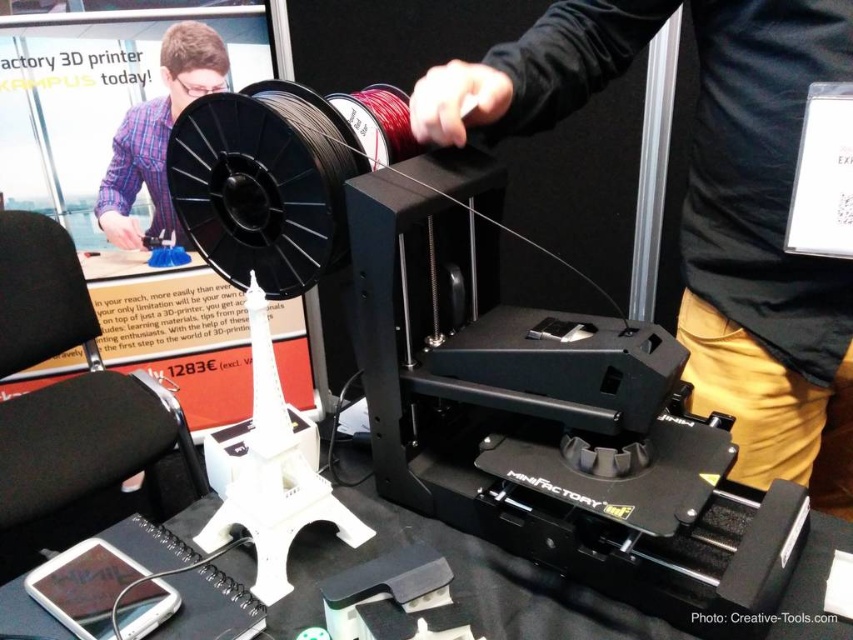
Between point (828, 40) and point (149, 182), which one is positioned in front?

Point (828, 40) is in front.

Where is `black matte 3d printer at center`? black matte 3d printer at center is located at coordinates (764, 248).

Which of these two, black matte table at center or matte black shirt at upper center, stands taller?

matte black shirt at upper center is taller.

Measure the distance between point (508, 632) and camera.

The distance of point (508, 632) from camera is 26.02 inches.

I want to click on black matte table at center, so click(460, 580).

Can you confirm if black matte 3d printer at center is positioned to the left of white plastic eiffel tower at lower center?

In fact, black matte 3d printer at center is to the right of white plastic eiffel tower at lower center.

In the scene shown: Is black matte 3d printer at center to the right of white plastic eiffel tower at lower center from the viewer's perspective?

Indeed, black matte 3d printer at center is positioned on the right side of white plastic eiffel tower at lower center.

Locate an element on the screen. The image size is (853, 640). black matte 3d printer at center is located at coordinates (764, 248).